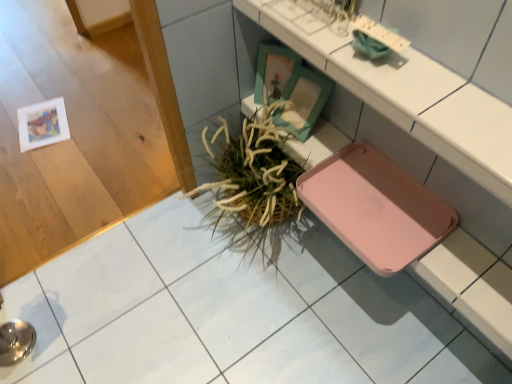
Question: From a real-world perspective, is metallic silver bowl at lower left below green woven basket at center?

Choices:
 (A) yes
 (B) no

Answer: (A)

Question: Is metallic silver bowl at lower left outside of green woven basket at center?

Choices:
 (A) yes
 (B) no

Answer: (A)

Question: Can you confirm if metallic silver bowl at lower left is wider than green woven basket at center?

Choices:
 (A) yes
 (B) no

Answer: (B)

Question: Does metallic silver bowl at lower left have a larger size compared to green woven basket at center?

Choices:
 (A) no
 (B) yes

Answer: (A)

Question: Is metallic silver bowl at lower left touching green woven basket at center?

Choices:
 (A) yes
 (B) no

Answer: (B)

Question: Is green woven basket at center taller or shorter than metallic silver bowl at lower left?

Choices:
 (A) tall
 (B) short

Answer: (A)

Question: From the image's perspective, relative to metallic silver bowl at lower left, is green woven basket at center above or below?

Choices:
 (A) above
 (B) below

Answer: (A)

Question: Is green woven basket at center in front of or behind metallic silver bowl at lower left in the image?

Choices:
 (A) front
 (B) behind

Answer: (B)

Question: Is green woven basket at center to the left or to the right of metallic silver bowl at lower left in the image?

Choices:
 (A) left
 (B) right

Answer: (B)

Question: From a real-world perspective, is metallic silver bowl at lower left above or below matte white counter at center?

Choices:
 (A) below
 (B) above

Answer: (A)

Question: From the image's perspective, is metallic silver bowl at lower left above or below matte white counter at center?

Choices:
 (A) above
 (B) below

Answer: (B)

Question: Considering the positions of point (54, 380) and point (284, 23), is point (54, 380) closer or farther from the camera than point (284, 23)?

Choices:
 (A) closer
 (B) farther

Answer: (B)

Question: Considering the positions of metallic silver bowl at lower left and matte white counter at center in the image, is metallic silver bowl at lower left wider or thinner than matte white counter at center?

Choices:
 (A) wide
 (B) thin

Answer: (A)

Question: Choose the correct answer: Is pink plastic tray at lower right inside green woven basket at center or outside it?

Choices:
 (A) inside
 (B) outside

Answer: (B)

Question: Based on their positions, is pink plastic tray at lower right located to the left or right of green woven basket at center?

Choices:
 (A) left
 (B) right

Answer: (B)